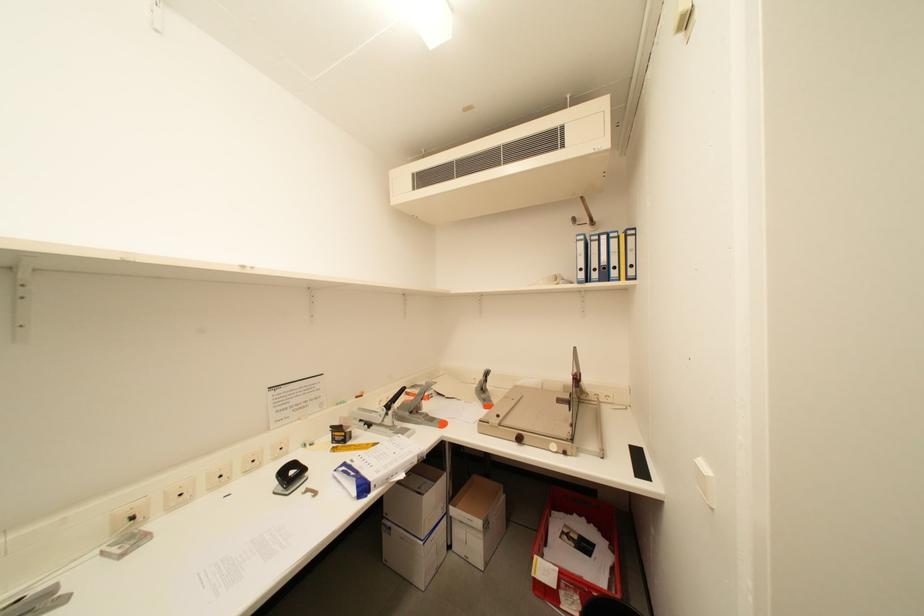
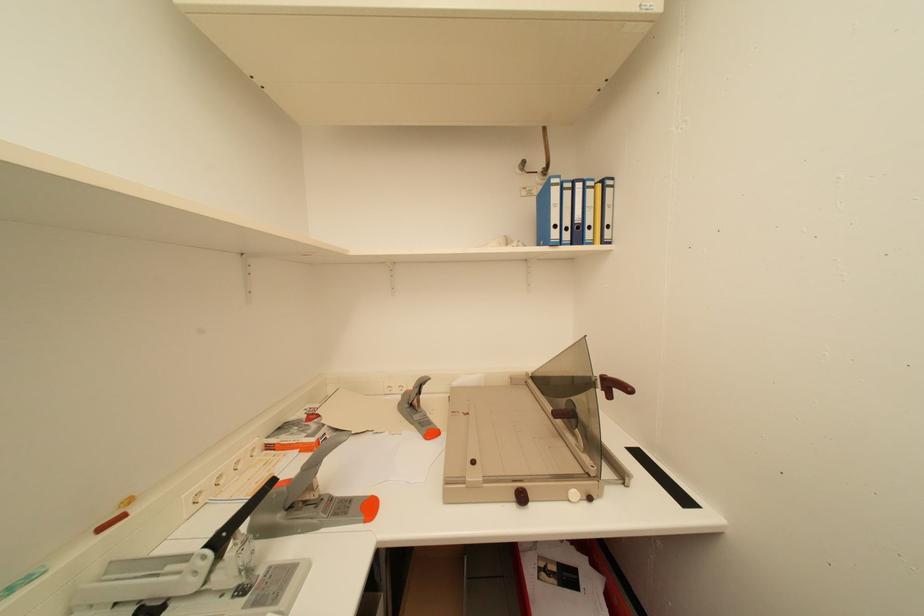
Question: The images are taken continuously from a first-person perspective. In which direction is your viewpoint rotating?

Choices:
 (A) Left
 (B) Right
 (C) Up
 (D) Down

Answer: (B)